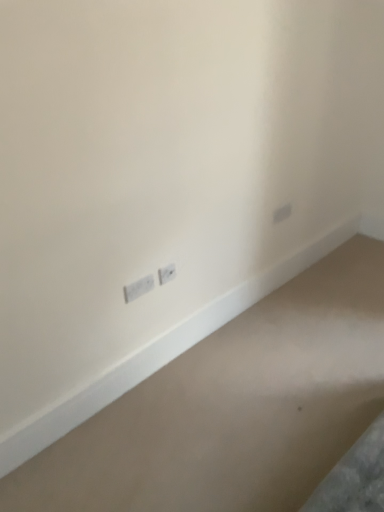
Question: Does smooth beige carpet at bottom have a smaller size compared to white plastic power plugs and sockets at lower left, the 2th power plugs and sockets when ordered from right to left?

Choices:
 (A) no
 (B) yes

Answer: (A)

Question: Considering the relative positions of smooth beige carpet at bottom and white plastic power plugs and sockets at lower left, the 1th power plugs and sockets positioned from the left, in the image provided, is smooth beige carpet at bottom to the left of white plastic power plugs and sockets at lower left, the 1th power plugs and sockets positioned from the left, from the viewer's perspective?

Choices:
 (A) no
 (B) yes

Answer: (A)

Question: Is smooth beige carpet at bottom far away from white plastic power plugs and sockets at lower left, the 1th power plugs and sockets positioned from the left?

Choices:
 (A) no
 (B) yes

Answer: (A)

Question: From the image's perspective, would you say smooth beige carpet at bottom is positioned over white plastic power plugs and sockets at lower left, the 2th power plugs and sockets when ordered from right to left?

Choices:
 (A) no
 (B) yes

Answer: (A)

Question: From a real-world perspective, is smooth beige carpet at bottom over white plastic power plugs and sockets at lower left, the 2th power plugs and sockets when ordered from right to left?

Choices:
 (A) yes
 (B) no

Answer: (B)

Question: Looking at the image, does smooth beige carpet at bottom seem bigger or smaller compared to white plastic power plugs and sockets at lower left, the 2th power plugs and sockets when ordered from right to left?

Choices:
 (A) small
 (B) big

Answer: (B)

Question: Considering the positions of point (223, 342) and point (150, 286), is point (223, 342) closer or farther from the camera than point (150, 286)?

Choices:
 (A) farther
 (B) closer

Answer: (A)

Question: Is smooth beige carpet at bottom in front of or behind white plastic power plugs and sockets at lower left, the 1th power plugs and sockets positioned from the left, in the image?

Choices:
 (A) front
 (B) behind

Answer: (A)

Question: From the image's perspective, relative to white plastic power plugs and sockets at lower left, the 2th power plugs and sockets when ordered from right to left, is smooth beige carpet at bottom above or below?

Choices:
 (A) above
 (B) below

Answer: (B)

Question: Based on their positions, is white plastic power plugs and sockets at lower left, the 1th power plugs and sockets positioned from the left, located to the left or right of smooth beige carpet at bottom?

Choices:
 (A) right
 (B) left

Answer: (B)

Question: Considering the positions of white plastic power plugs and sockets at lower left, the 2th power plugs and sockets when ordered from right to left, and smooth beige carpet at bottom in the image, is white plastic power plugs and sockets at lower left, the 2th power plugs and sockets when ordered from right to left, bigger or smaller than smooth beige carpet at bottom?

Choices:
 (A) small
 (B) big

Answer: (A)

Question: In terms of width, does white plastic power plugs and sockets at lower left, the 2th power plugs and sockets when ordered from right to left, look wider or thinner when compared to smooth beige carpet at bottom?

Choices:
 (A) thin
 (B) wide

Answer: (A)

Question: Relative to smooth beige carpet at bottom, is white plastic power plugs and sockets at lower left, the 2th power plugs and sockets when ordered from right to left, in front or behind?

Choices:
 (A) behind
 (B) front

Answer: (A)

Question: Is white plastic power plugs and sockets at lower left, the 2th power plugs and sockets when ordered from right to left, bigger or smaller than white plastic power plugs and sockets at center, the 2th power plugs and sockets in the left-to-right sequence?

Choices:
 (A) small
 (B) big

Answer: (B)

Question: Visually, is white plastic power plugs and sockets at lower left, the 2th power plugs and sockets when ordered from right to left, positioned to the left or to the right of white plastic power plugs and sockets at center, which is the first power plugs and sockets from right to left?

Choices:
 (A) right
 (B) left

Answer: (B)